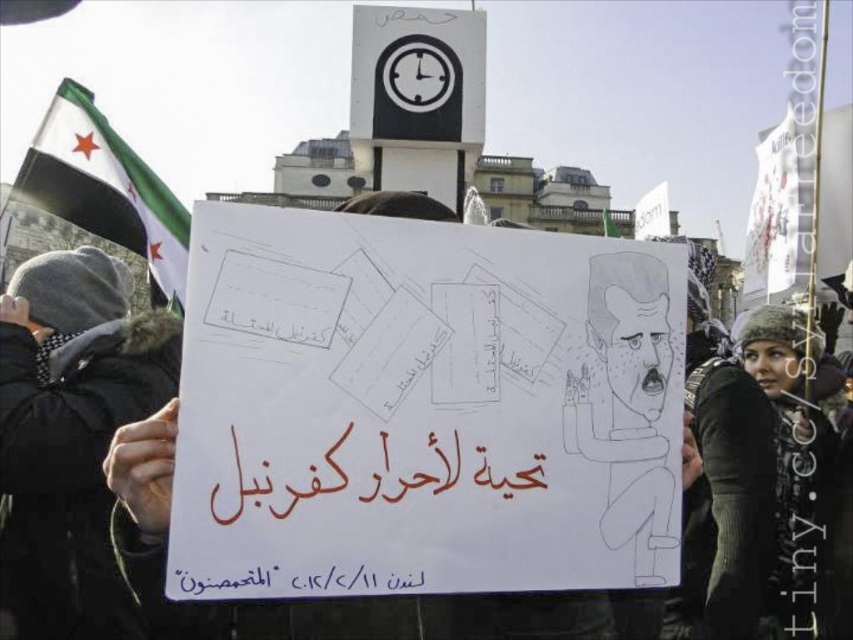
Question: Considering the real-world distances, which object is farthest from the red calligraphy at center?

Choices:
 (A) black paper at lower center
 (B) dark gray knit hat at upper left

Answer: (B)

Question: Estimate the real-world distances between objects in this image. Which object is closer to the dark gray knit hat at upper left?

Choices:
 (A) black paper at lower center
 (B) white paper sign at center

Answer: (B)

Question: Does red calligraphy at center have a larger size compared to white fabric flag at upper left?

Choices:
 (A) no
 (B) yes

Answer: (A)

Question: Which object is farther from the camera taking this photo?

Choices:
 (A) white paper sign at center
 (B) red calligraphy at center

Answer: (A)

Question: Is white fabric flag at upper left thinner than black paper at lower center?

Choices:
 (A) no
 (B) yes

Answer: (B)

Question: Can you confirm if white paper sign at center is positioned above dark gray knit hat at upper left?

Choices:
 (A) yes
 (B) no

Answer: (A)